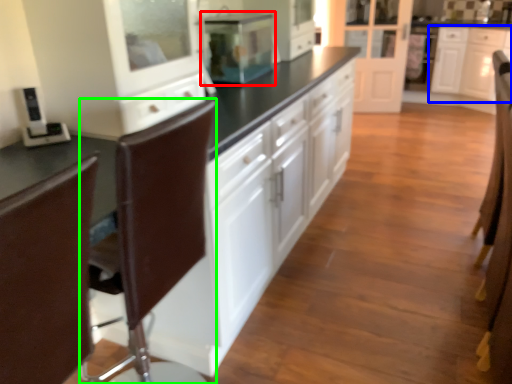
Question: Which object is the closest to the home appliance (highlighted by a red box)? Choose among these: cabinetry (highlighted by a blue box) or swivel chair (highlighted by a green box).

Choices:
 (A) cabinetry
 (B) swivel chair

Answer: (B)